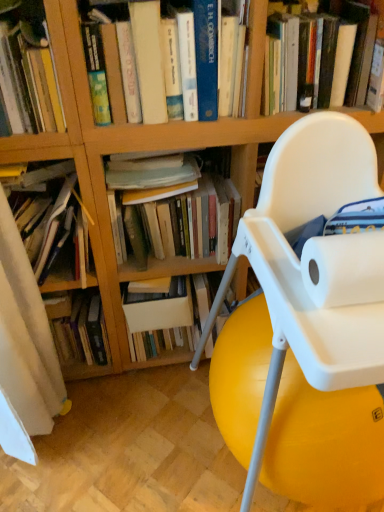
Question: Can white plastic chair at center be found inside hardcover book at upper left, the 4th book from the right?

Choices:
 (A) yes
 (B) no

Answer: (B)

Question: Considering the relative sizes of hardcover book at upper left, the 4th book from the right, and white plastic chair at center in the image provided, is hardcover book at upper left, the 4th book from the right, wider than white plastic chair at center?

Choices:
 (A) yes
 (B) no

Answer: (B)

Question: Is hardcover book at upper left, the 4th book from the right, positioned with its back to white plastic chair at center?

Choices:
 (A) no
 (B) yes

Answer: (A)

Question: From a real-world perspective, is hardcover book at upper left, the 4th book from the right, below white plastic chair at center?

Choices:
 (A) yes
 (B) no

Answer: (B)

Question: Does hardcover book at upper left, which is the 3th book in left-to-right order, appear on the left side of white plastic chair at center?

Choices:
 (A) no
 (B) yes

Answer: (B)

Question: Considering the positions of point (64, 222) and point (210, 119), is point (64, 222) closer or farther from the camera than point (210, 119)?

Choices:
 (A) closer
 (B) farther

Answer: (B)

Question: Relative to hardcover book at upper center, positioned as the third book in right-to-left order, is hardcover books at left, placed as the 6th book when sorted from right to left, in front or behind?

Choices:
 (A) behind
 (B) front

Answer: (A)

Question: Is hardcover books at left, placed as the 6th book when sorted from right to left, situated inside hardcover book at upper center, positioned as the third book in right-to-left order, or outside?

Choices:
 (A) inside
 (B) outside

Answer: (B)

Question: From their relative heights in the image, would you say hardcover books at left, the 1th book positioned from the left, is taller or shorter than hardcover book at upper center, which is counted as the fourth book, starting from the left?

Choices:
 (A) tall
 (B) short

Answer: (B)

Question: Does point (82, 245) appear closer or farther from the camera than point (94, 352)?

Choices:
 (A) farther
 (B) closer

Answer: (B)

Question: From a real-world perspective, is hardcover books at left, placed as the 6th book when sorted from right to left, physically located above or below hardcover book at left, which appears as the 5th book when viewed from the right?

Choices:
 (A) above
 (B) below

Answer: (A)

Question: From the image's perspective, is hardcover books at left, placed as the 6th book when sorted from right to left, above or below hardcover book at left, which appears as the 5th book when viewed from the right?

Choices:
 (A) below
 (B) above

Answer: (B)

Question: In terms of size, does hardcover books at left, placed as the 6th book when sorted from right to left, appear bigger or smaller than hardcover book at left, which ranks as the 2th book in left-to-right order?

Choices:
 (A) big
 (B) small

Answer: (A)

Question: In terms of width, does hardcover book at upper center, the sixth book from the left, look wider or thinner when compared to hardcover book at upper left, the 4th book from the right?

Choices:
 (A) wide
 (B) thin

Answer: (B)

Question: From a real-world perspective, relative to hardcover book at upper left, the 4th book from the right, is hardcover book at upper center, the sixth book from the left, vertically above or below?

Choices:
 (A) above
 (B) below

Answer: (B)